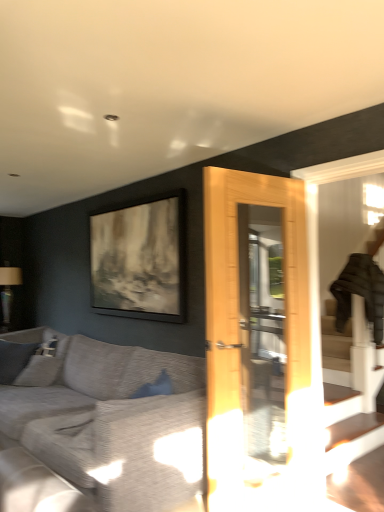
Describe the element at coordinates (101, 426) in the screenshot. I see `textured gray couch at center` at that location.

Image resolution: width=384 pixels, height=512 pixels. Identify the location of textured gray couch at center. (101, 426).

Identify the location of textured gray couch at center. (101, 426).